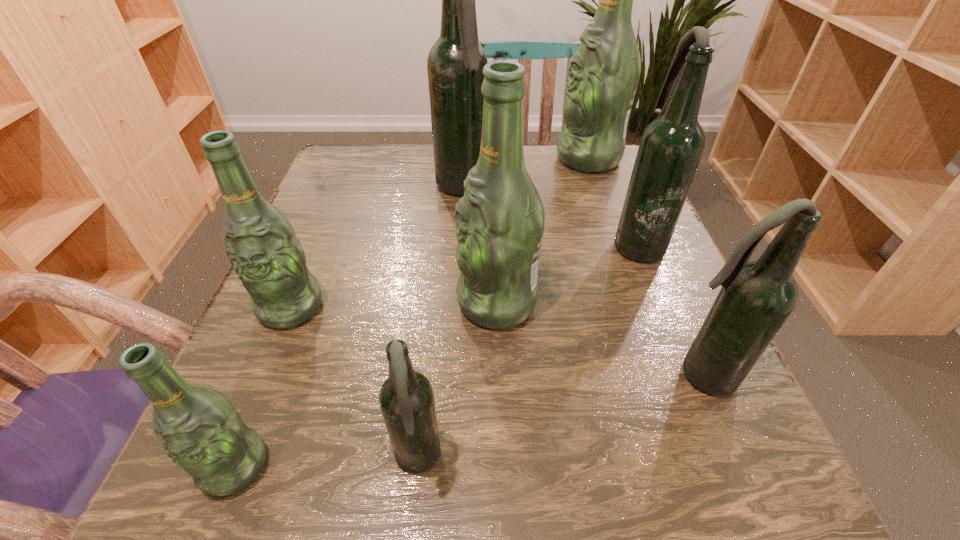
This screenshot has width=960, height=540. I want to click on vacant space at the far right corner of the desktop, so click(x=628, y=157).

At what (x,y) coordinates should I click in order to perform the action: click on vacant area at the near right corner of the desktop. Please return your answer as a coordinate pair (x, y). Image resolution: width=960 pixels, height=540 pixels. Looking at the image, I should click on (670, 466).

Where is `free spot between the smallest dark beer bottle and the nearest green beer bottle`? Image resolution: width=960 pixels, height=540 pixels. free spot between the smallest dark beer bottle and the nearest green beer bottle is located at coordinates (325, 463).

Identify the location of vacant space in between the smallest dark beer bottle and the second farthest dark beer bottle. The image size is (960, 540). (527, 351).

Locate an element on the screen. The image size is (960, 540). vacant space that is in between the third biggest green beer bottle and the smallest green beer bottle is located at coordinates (263, 386).

Identify the location of vacant point located between the rightmost green beer bottle and the nearest green beer bottle. Image resolution: width=960 pixels, height=540 pixels. (411, 312).

Find the location of a particular element. The image size is (960, 540). vacant space that's between the third farthest object and the third smallest green beer bottle is located at coordinates (566, 272).

Find the location of a particular element. free area in between the second smallest green beer bottle and the farthest dark beer bottle is located at coordinates (376, 248).

I want to click on vacant region between the nearest green beer bottle and the biggest green beer bottle, so click(411, 312).

Locate an element on the screen. vacant area between the smallest dark beer bottle and the third smallest green beer bottle is located at coordinates click(x=457, y=381).